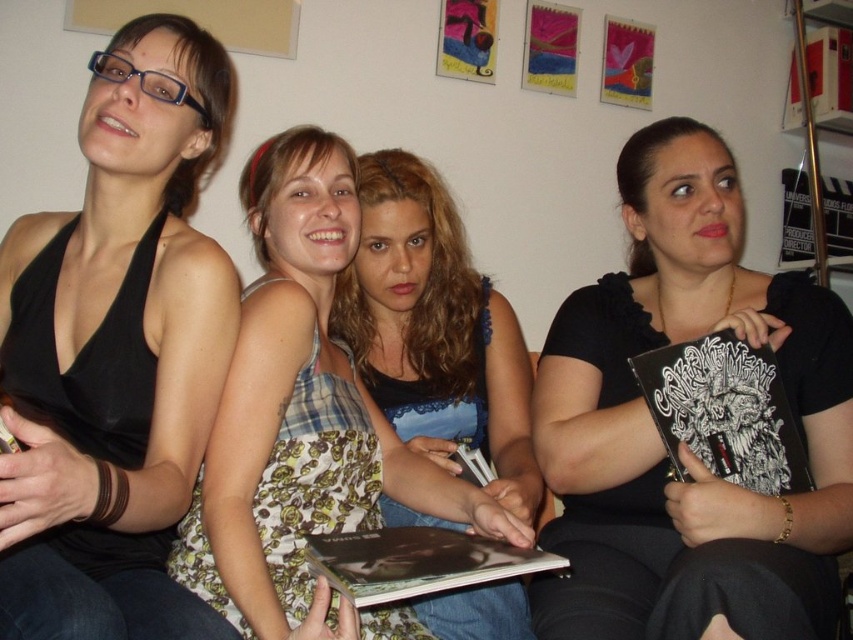
Is black matte book at center positioned before plaid fabric dress at center?

No, it is behind plaid fabric dress at center.

Is point (598, 486) less distant than point (277, 253)?

Yes, point (598, 486) is in front of point (277, 253).

Which is behind, point (585, 493) or point (380, 454)?

The point (585, 493) is more distant.

Image resolution: width=853 pixels, height=640 pixels. Find the location of `black matte book at center`. black matte book at center is located at coordinates (685, 449).

Does black matte tank top at left appear on the left side of plaid fabric dress at center?

Correct, you'll find black matte tank top at left to the left of plaid fabric dress at center.

Between black matte tank top at left and plaid fabric dress at center, which one appears on the right side from the viewer's perspective?

Positioned to the right is plaid fabric dress at center.

Does point (80, 557) lie in front of point (241, 470)?

Yes, point (80, 557) is closer to viewer.

What are the coordinates of `black matte tank top at left` in the screenshot? It's located at (115, 353).

Does black matte tank top at left appear on the left side of black matte book at center?

Correct, you'll find black matte tank top at left to the left of black matte book at center.

Find the location of `black matte tank top at left`. black matte tank top at left is located at coordinates (115, 353).